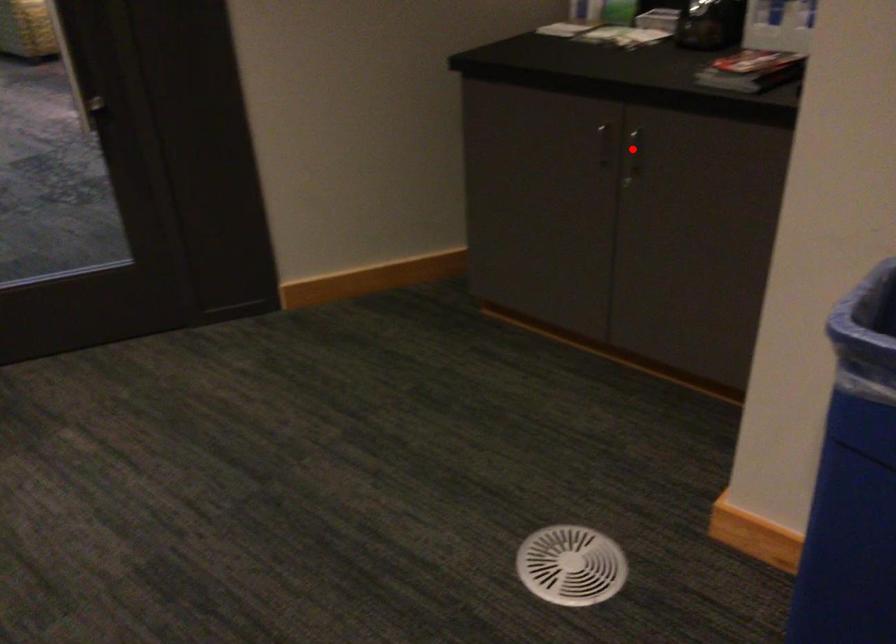
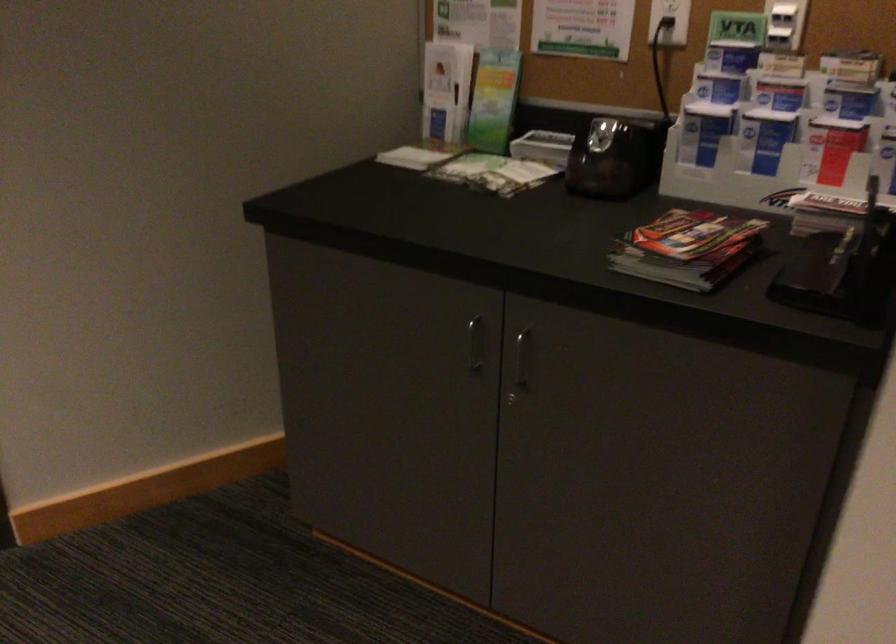
The point at the highlighted location is marked in the first image. Where is the corresponding point in the second image?

(521, 357)